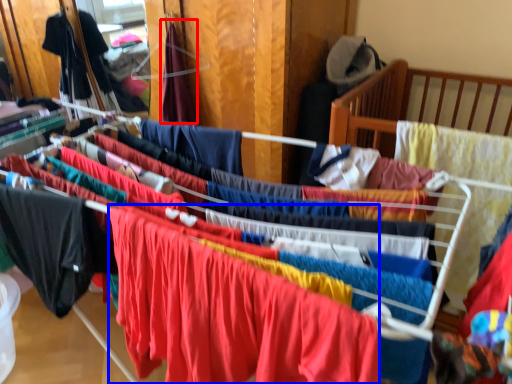
Question: Which object is closer to the camera taking this photo, clothing (highlighted by a red box) or clothing (highlighted by a blue box)?

Choices:
 (A) clothing
 (B) clothing

Answer: (B)